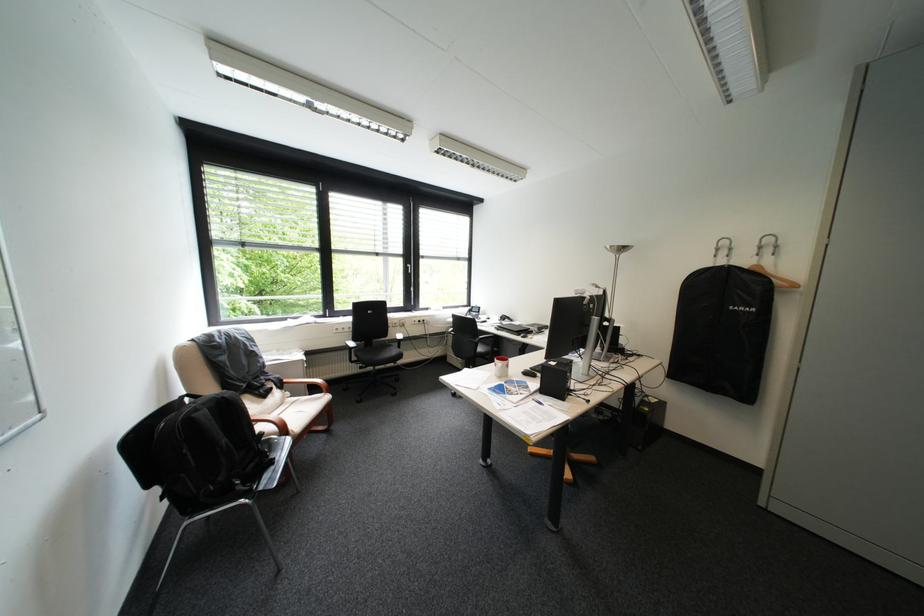
I want to click on black office phone, so click(x=473, y=312).